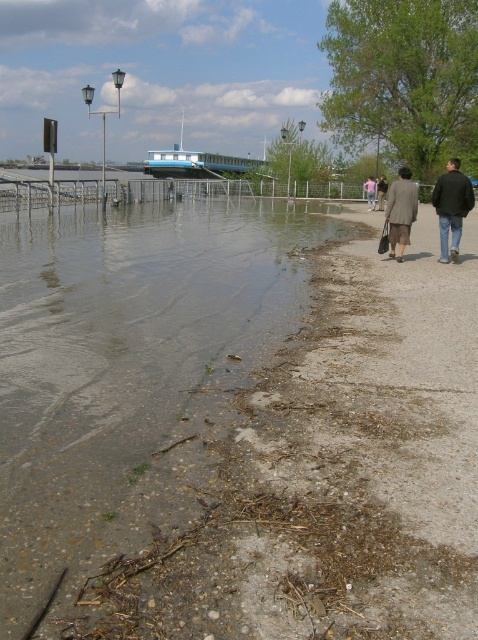
Question: Does matte gray coat at center appear on the right side of pink fabric couple at center?

Choices:
 (A) no
 (B) yes

Answer: (A)

Question: Is dark blue jacket at right above pink fabric couple at center?

Choices:
 (A) no
 (B) yes

Answer: (A)

Question: Which object appears closest to the camera in this image?

Choices:
 (A) dark blue jacket at right
 (B) pink fabric couple at center
 (C) matte gray coat at center
 (D) brown dirt at lower left

Answer: (D)

Question: Is dark blue jacket at right wider than matte gray coat at center?

Choices:
 (A) no
 (B) yes

Answer: (B)

Question: Which point is closer to the camera taking this photo?

Choices:
 (A) 369,179
 (B) 398,188

Answer: (B)

Question: Among these points, which one is nearest to the camera?

Choices:
 (A) (398, 257)
 (B) (371, 205)
 (C) (435, 204)
 (D) (111, 236)

Answer: (C)